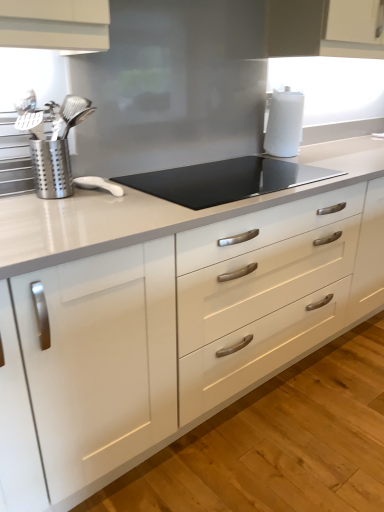
Question: Does silver metallic utensil holder at left come in front of black glass cooktop at center?

Choices:
 (A) no
 (B) yes

Answer: (B)

Question: Would you say silver metallic utensil holder at left is a long distance from black glass cooktop at center?

Choices:
 (A) no
 (B) yes

Answer: (A)

Question: From a real-world perspective, is silver metallic utensil holder at left positioned under black glass cooktop at center based on gravity?

Choices:
 (A) no
 (B) yes

Answer: (A)

Question: Would you say silver metallic utensil holder at left is outside black glass cooktop at center?

Choices:
 (A) no
 (B) yes

Answer: (B)

Question: Is silver metallic utensil holder at left further to camera compared to black glass cooktop at center?

Choices:
 (A) no
 (B) yes

Answer: (A)

Question: From a real-world perspective, does silver metallic utensil holder at left stand above black glass cooktop at center?

Choices:
 (A) no
 (B) yes

Answer: (B)

Question: Is white glossy countertop at center located outside silver metallic utensil holder at left?

Choices:
 (A) no
 (B) yes

Answer: (B)

Question: Is white glossy countertop at center positioned behind silver metallic utensil holder at left?

Choices:
 (A) no
 (B) yes

Answer: (A)

Question: Is white glossy countertop at center in contact with silver metallic utensil holder at left?

Choices:
 (A) no
 (B) yes

Answer: (A)

Question: Would you say white glossy countertop at center is a long distance from silver metallic utensil holder at left?

Choices:
 (A) yes
 (B) no

Answer: (B)

Question: Does white glossy countertop at center turn towards silver metallic utensil holder at left?

Choices:
 (A) no
 (B) yes

Answer: (A)

Question: Does white glossy countertop at center have a smaller size compared to silver metallic utensil holder at left?

Choices:
 (A) yes
 (B) no

Answer: (B)

Question: From the image's perspective, is black glass cooktop at center on top of white glossy countertop at center?

Choices:
 (A) yes
 (B) no

Answer: (A)